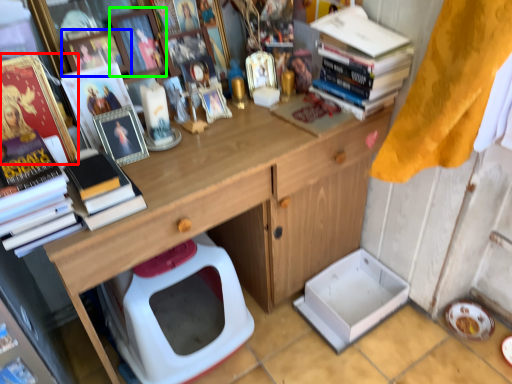
Question: Which object is positioned closest to book (highlighted by a red box)? Select from picture frame (highlighted by a blue box) and picture frame (highlighted by a green box).

Choices:
 (A) picture frame
 (B) picture frame

Answer: (A)